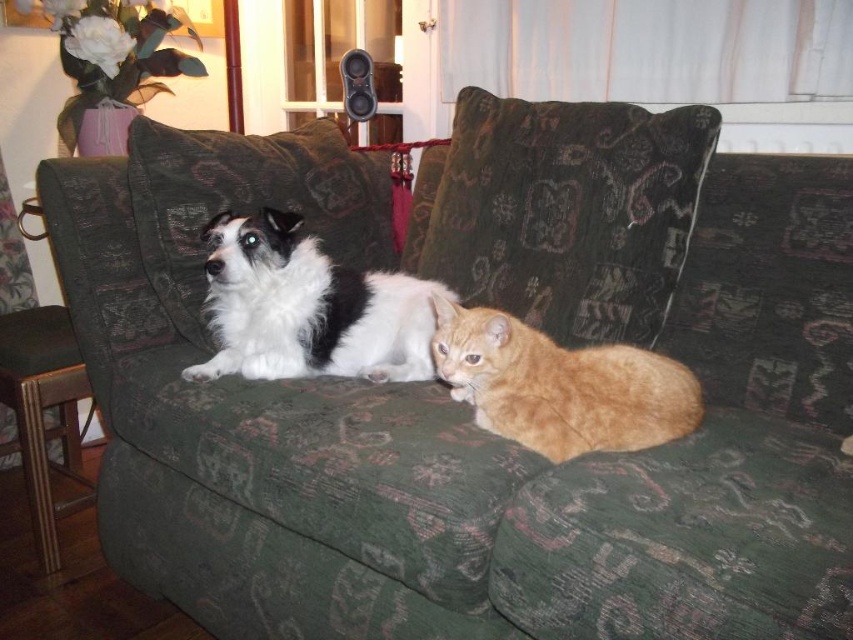
You are a delivery person who just arrived at this cozy indoor setting. You need to place a small package on the surface that can support it. Which object between the orange fur cat at center and the black plastic speaker at upper center should you choose?

The black plastic speaker at upper center is the better choice because it is shorter than the orange fur cat at center, making it more likely to be a stable surface for placing the package.

You are a guest in this living room and want to place a small plant between the white fluffy dog at center and the black plastic speaker at upper center. Based on their positions, where should you place the plant?

The white fluffy dog at center is positioned under the black plastic speaker at upper center, so you should place the plant between them in the space below the speaker and above the dog.

You are a delivery person who needs to place a small package on the highest available surface in the room. Looking at the scene, which object between the orange fur cat at center and the black plastic speaker at upper center should you choose?

The black plastic speaker at upper center is the highest object between the two, so you should place the package there.